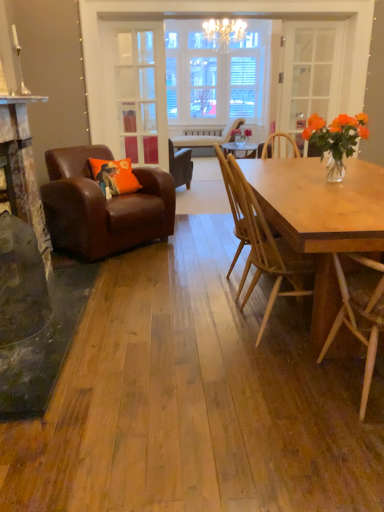
Question: From a real-world perspective, is natural wood chair at right, which is the second chair in bottom-to-top order, physically located above or below leather armchair at center, which ranks as the first chair in top-to-bottom order?

Choices:
 (A) above
 (B) below

Answer: (A)

Question: Does point (254, 264) appear closer or farther from the camera than point (208, 130)?

Choices:
 (A) closer
 (B) farther

Answer: (A)

Question: Which object is positioned closest to the metallic silver fireplace at left?

Choices:
 (A) light brown wooden chair at right, which ranks as the 4th chair in top-to-bottom order
 (B) leather armchair at center, which is counted as the first chair, starting from the back
 (C) clear glass door at center, arranged as the first glass door when viewed from the left
 (D) orange fabric pillow at left
 (E) natural wood chair at right, the 3th chair in the back-to-front sequence

Answer: (D)

Question: Considering the real-world distances, which object is farthest from the metallic silver fireplace at left?

Choices:
 (A) leather armchair at center, which is the 4th chair from bottom to top
 (B) light brown wooden chair at right, the fourth chair in the back-to-front sequence
 (C) clear glass door at center, arranged as the first glass door when viewed from the left
 (D) brown leather armchair at left, which ranks as the 3th chair in front-to-back order
 (E) clear glass door at upper center, the 1th glass door positioned from the right

Answer: (B)